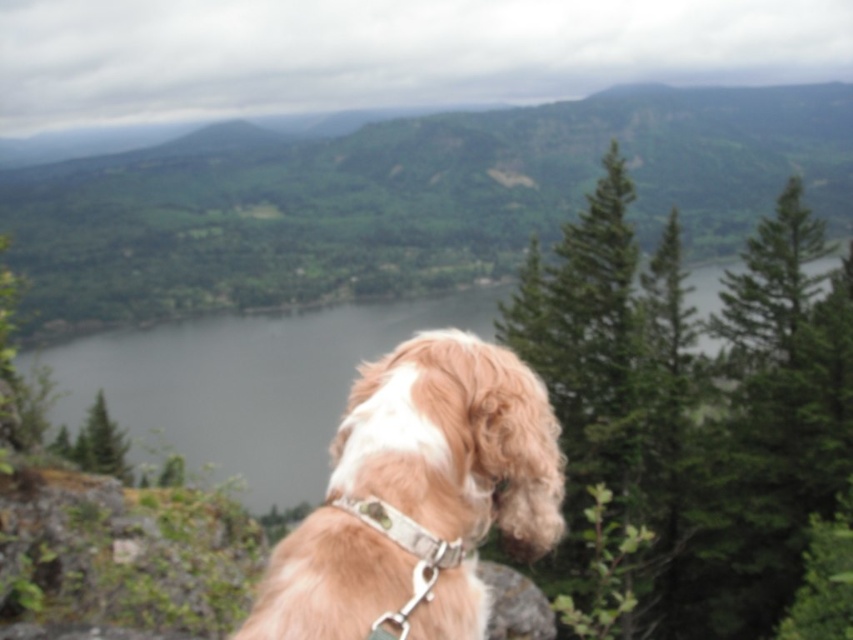
Question: Which of the following is the farthest from the observer?

Choices:
 (A) white fabric neckband at center
 (B) green water at center
 (C) golden fur dog at center

Answer: (B)

Question: Which object appears closest to the camera in this image?

Choices:
 (A) white fabric neckband at center
 (B) green water at center
 (C) golden fur dog at center

Answer: (C)

Question: Which of the following is the closest to the observer?

Choices:
 (A) golden fur dog at center
 (B) green water at center
 (C) white fabric neckband at center

Answer: (A)

Question: Is the position of golden fur dog at center more distant than that of green water at center?

Choices:
 (A) no
 (B) yes

Answer: (A)

Question: Can you confirm if golden fur dog at center is wider than green water at center?

Choices:
 (A) yes
 (B) no

Answer: (B)

Question: Is golden fur dog at center positioned at the back of white fabric neckband at center?

Choices:
 (A) yes
 (B) no

Answer: (B)